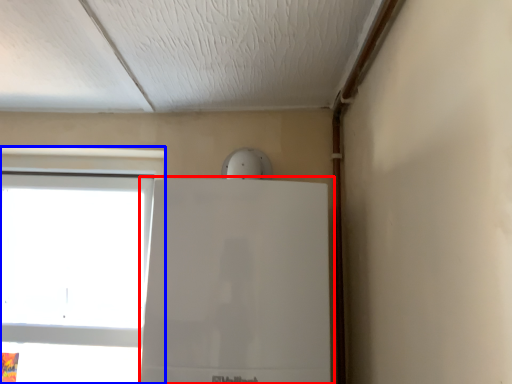
Question: Which object is closer to the camera taking this photo, fridge (highlighted by a red box) or window (highlighted by a blue box)?

Choices:
 (A) fridge
 (B) window

Answer: (A)